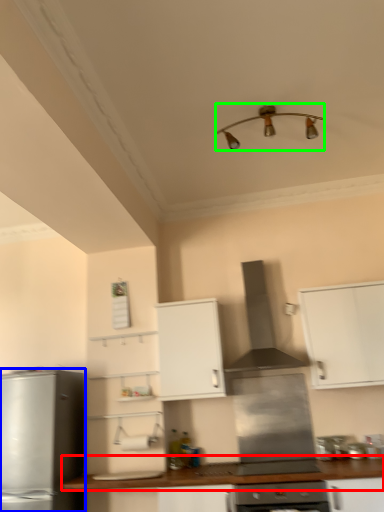
Question: Which object is positioned closest to countertop (highlighted by a red box)? Select from kitchen appliance (highlighted by a blue box) and light fixture (highlighted by a green box).

Choices:
 (A) kitchen appliance
 (B) light fixture

Answer: (A)